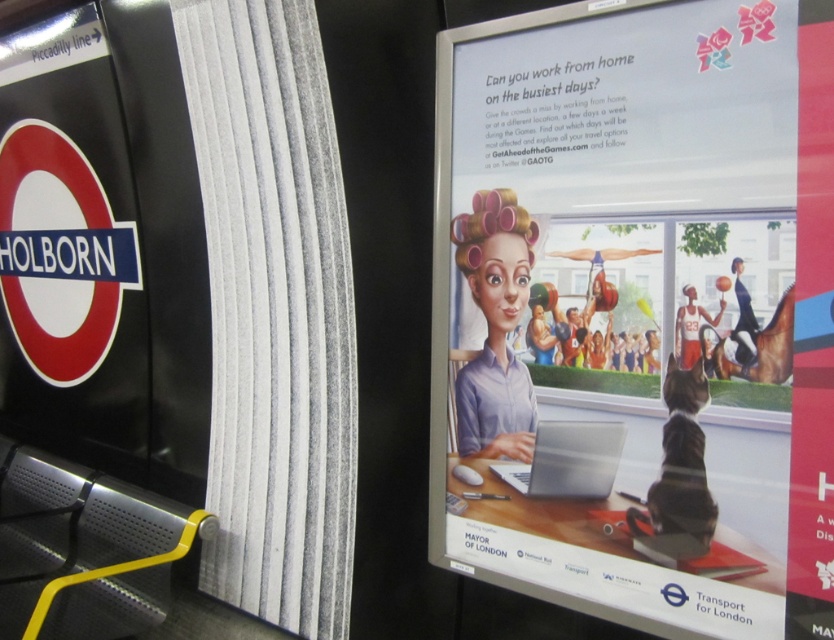
Question: Which point appears closest to the camera in this image?

Choices:
 (A) (747, 492)
 (B) (214, 492)
 (C) (599, 440)

Answer: (A)

Question: Is metallic silver signboard at left below silver metallic laptop at center?

Choices:
 (A) yes
 (B) no

Answer: (B)

Question: Considering the real-world distances, which object is farthest from the silver metallic laptop at center?

Choices:
 (A) matte white laptop at center
 (B) metallic silver signboard at left

Answer: (B)

Question: Is matte white laptop at center to the right of metallic silver signboard at left from the viewer's perspective?

Choices:
 (A) yes
 (B) no

Answer: (A)

Question: Does matte white laptop at center lie behind silver metallic laptop at center?

Choices:
 (A) yes
 (B) no

Answer: (B)

Question: Estimate the real-world distances between objects in this image. Which object is closer to the silver metallic laptop at center?

Choices:
 (A) matte white laptop at center
 (B) metallic silver signboard at left

Answer: (A)